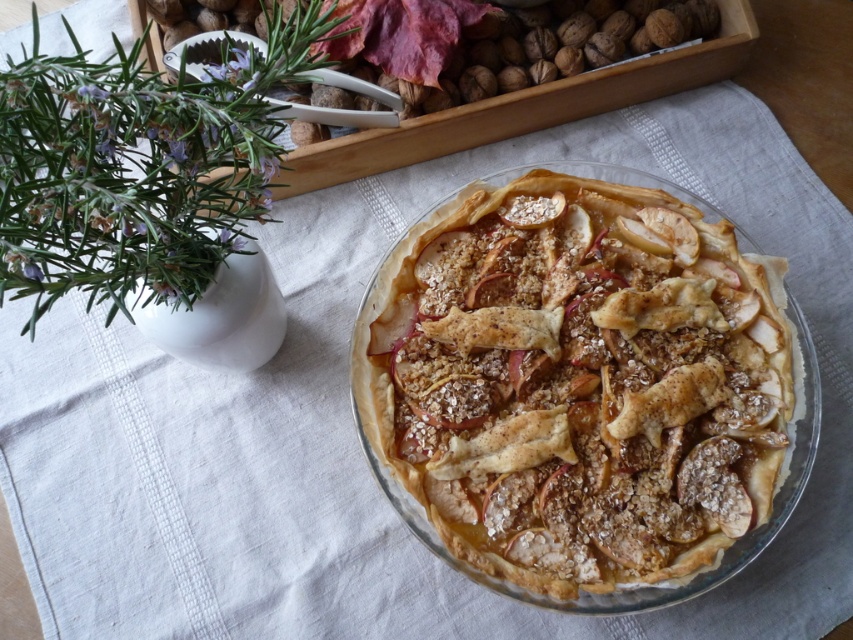
You are arranging a Thanksgiving table and want to place the brown textured nuts at upper center and the golden flaky pie at center. Based on the scene, which item is positioned further back from the viewer?

The brown textured nuts at upper center are positioned further back from the viewer because they are described as being behind the golden flaky pie at center.

You are arranging a Thanksgiving table and want to place the golden flaky pie at center and the brown textured nuts at upper center. According to the image, which item is located to the right of the other?

The golden flaky pie at center is positioned on the right side of brown textured nuts at upper center, so the pie is to the right of the nuts.